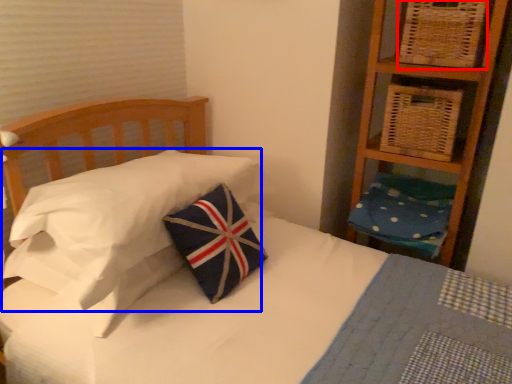
Question: Which object is further to the camera taking this photo, basket (highlighted by a red box) or pillow (highlighted by a blue box)?

Choices:
 (A) basket
 (B) pillow

Answer: (A)